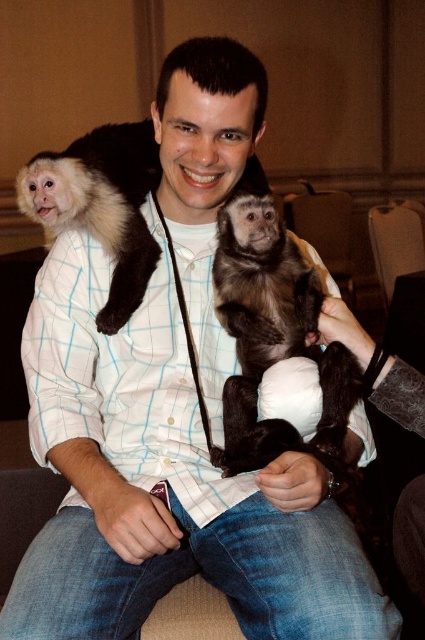
Question: Is dark brown fur monkey at upper left closer to camera compared to brown leather armchair at upper center?

Choices:
 (A) yes
 (B) no

Answer: (A)

Question: Which point appears farthest from the camera in this image?

Choices:
 (A) (70, 200)
 (B) (402, 260)

Answer: (B)

Question: Which of the following is the farthest from the observer?

Choices:
 (A) dark brown fur monkey at upper left
 (B) brown leather armchair at upper center
 (C) brown furry monkey at center

Answer: (B)

Question: Can you confirm if brown furry monkey at center is smaller than dark brown fur monkey at upper left?

Choices:
 (A) no
 (B) yes

Answer: (B)

Question: Which point is farther to the camera?

Choices:
 (A) (102, 224)
 (B) (288, 445)

Answer: (A)

Question: In this image, where is dark brown fur monkey at upper left located relative to brown leather armchair at upper center?

Choices:
 (A) left
 (B) right

Answer: (A)